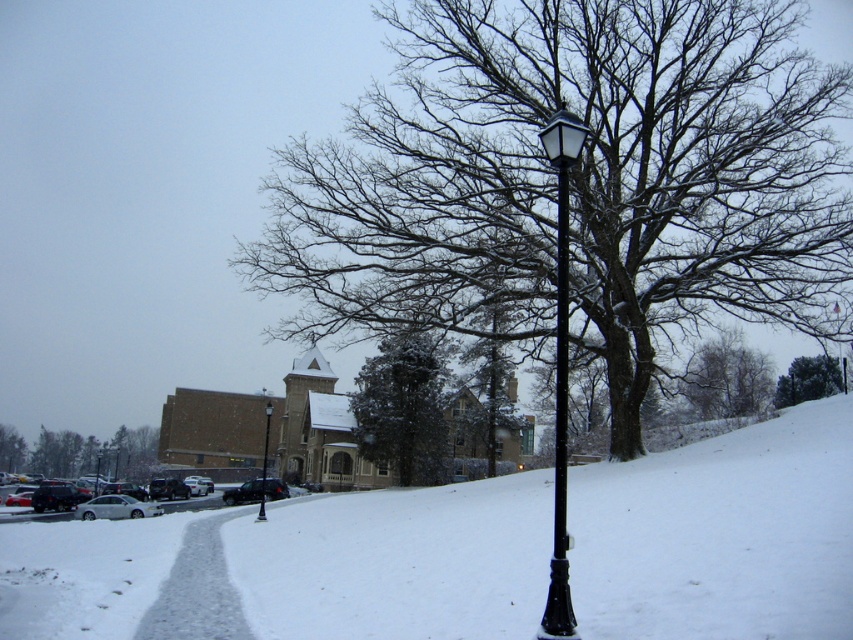
Question: Among these points, which one is farthest from the camera?

Choices:
 (A) (51, 429)
 (B) (96, 500)
 (C) (96, 467)
 (D) (144, 586)

Answer: (A)

Question: In this image, where is white matte snow at center located relative to white glossy sedan at lower left?

Choices:
 (A) below
 (B) above

Answer: (B)

Question: Which object is closer to the camera taking this photo?

Choices:
 (A) black matte street light at center
 (B) green leafy tree at upper right

Answer: (A)

Question: Which point appears farthest from the camera in this image?

Choices:
 (A) (236, 488)
 (B) (268, 429)

Answer: (B)

Question: Can you confirm if black matte street light at center is wider than dark gray metallic car at center?

Choices:
 (A) no
 (B) yes

Answer: (A)

Question: Observing the image, what is the correct spatial positioning of green leafy tree at left in reference to black metal street light at lower left?

Choices:
 (A) above
 (B) below

Answer: (A)